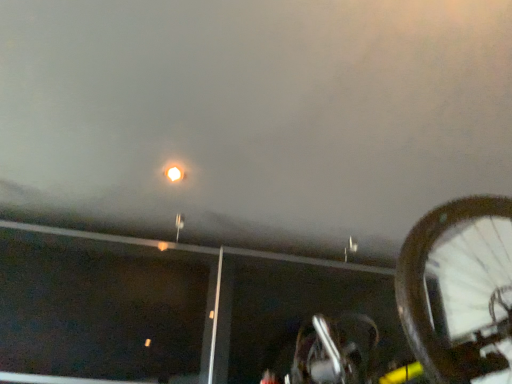
Question: Looking at their shapes, would you say shiny metallic bicycle at lower right is wider or thinner than metallic silver street light at upper center?

Choices:
 (A) thin
 (B) wide

Answer: (B)

Question: Considering the relative positions of shiny metallic bicycle at lower right and metallic silver street light at upper center in the image provided, is shiny metallic bicycle at lower right to the left or to the right of metallic silver street light at upper center?

Choices:
 (A) right
 (B) left

Answer: (A)

Question: Considering the positions of point (467, 253) and point (354, 240), is point (467, 253) closer or farther from the camera than point (354, 240)?

Choices:
 (A) farther
 (B) closer

Answer: (B)

Question: From a real-world perspective, is metallic silver street light at upper center positioned above or below shiny metallic bicycle at lower right?

Choices:
 (A) above
 (B) below

Answer: (A)

Question: Is metallic silver street light at upper center bigger or smaller than shiny metallic bicycle at lower right?

Choices:
 (A) big
 (B) small

Answer: (B)

Question: In the image, is metallic silver street light at upper center positioned in front of or behind shiny metallic bicycle at lower right?

Choices:
 (A) front
 (B) behind

Answer: (B)

Question: From the image's perspective, is metallic silver street light at upper center above or below shiny metallic bicycle at lower right?

Choices:
 (A) below
 (B) above

Answer: (B)